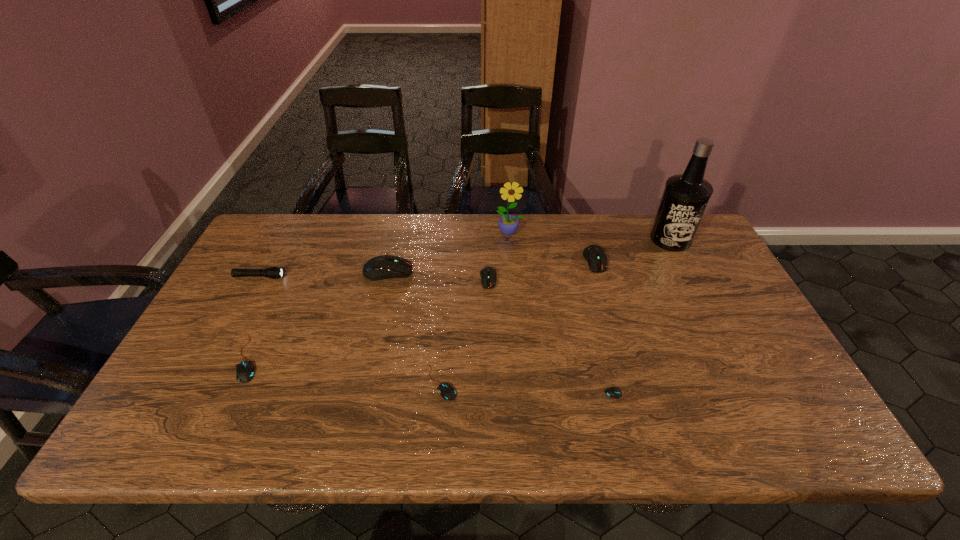
In order to click on liquor in this screenshot , I will do `click(685, 197)`.

The width and height of the screenshot is (960, 540). I want to click on the rightmost object, so click(685, 197).

You are a GUI agent. You are given a task and a screenshot of the screen. Output one action in this format:
    pyautogui.click(x=<x>, y=<y>)
    Task: Click on the eighth shortest object
    Image resolution: width=960 pixels, height=540 pixels.
    Given the screenshot: What is the action you would take?
    pyautogui.click(x=508, y=224)

Image resolution: width=960 pixels, height=540 pixels. I want to click on sunflower, so 508,224.

At what (x,y) coordinates should I click in order to perform the action: click on the third tallest object. Please return your answer as a coordinate pair (x, y). Looking at the image, I should click on (381, 267).

Identify the location of the seventh object from right to left. Image resolution: width=960 pixels, height=540 pixels. (381, 267).

Where is `the second biggest dark computer equipment`? This screenshot has width=960, height=540. the second biggest dark computer equipment is located at coordinates (595, 256).

The height and width of the screenshot is (540, 960). Identify the location of the second tallest mouse. point(595,256).

Where is `flashlight`? flashlight is located at coordinates (273, 272).

This screenshot has height=540, width=960. What are the coordinates of `the third mouse from right to left` in the screenshot? It's located at [x=488, y=274].